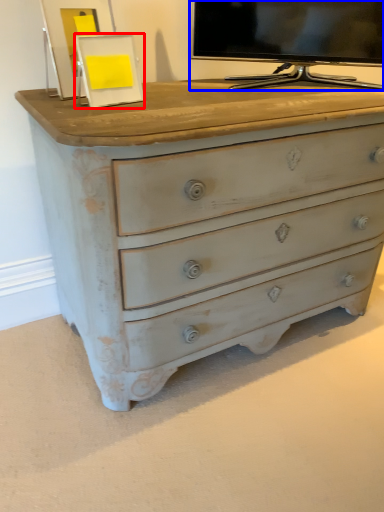
Question: Which of the following is the farthest to the observer, picture frame (highlighted by a red box) or television (highlighted by a blue box)?

Choices:
 (A) picture frame
 (B) television

Answer: (B)